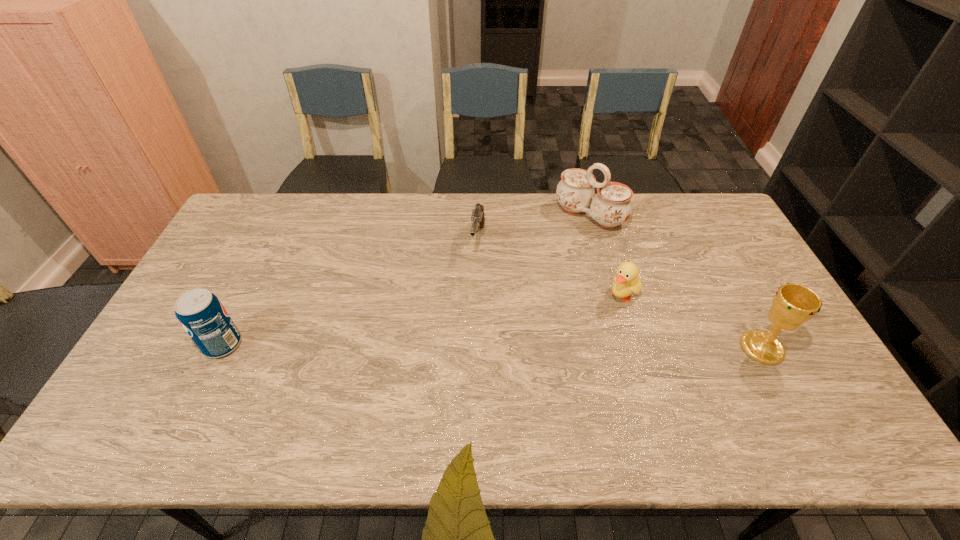
Where is `free space between the third tallest object and the duckling`? Image resolution: width=960 pixels, height=540 pixels. free space between the third tallest object and the duckling is located at coordinates (422, 320).

This screenshot has height=540, width=960. In order to click on unoccupied position between the chalice and the leftmost object in this screenshot , I will do `click(492, 346)`.

You are a GUI agent. You are given a task and a screenshot of the screen. Output one action in this format:
    pyautogui.click(x=<x>, y=<y>)
    Task: Click on the unoccupied area between the chinaware and the leftmost object
    This screenshot has height=540, width=960.
    Given the screenshot: What is the action you would take?
    pyautogui.click(x=406, y=280)

The image size is (960, 540). Find the location of `free space between the leftmost object and the chinaware`. free space between the leftmost object and the chinaware is located at coordinates (406, 280).

Identify which object is the nearest to the pop. Please provide its 2D coordinates. Your answer should be formatted as a tuple, i.e. [(x, y)], where the tuple contains the x and y coordinates of a point satisfying the conditions above.

[(477, 217)]

The width and height of the screenshot is (960, 540). I want to click on object that is the third closest to the pistol, so click(x=202, y=315).